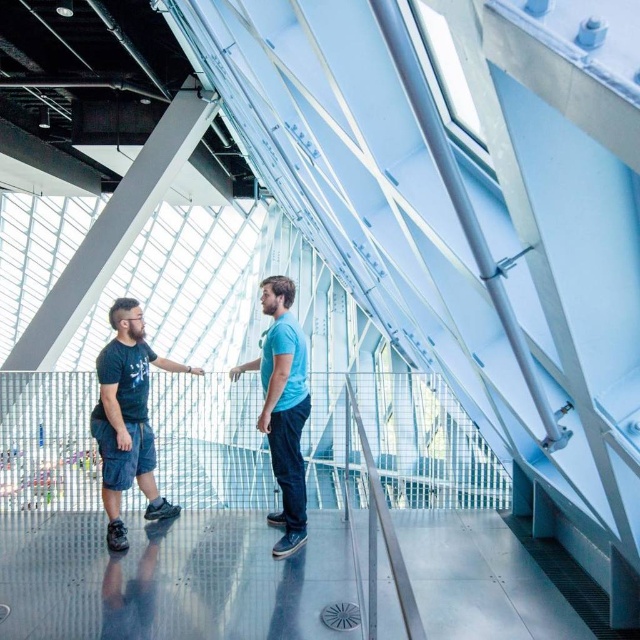
Can you confirm if dark gray cotton shorts at left is positioned to the right of blue cotton t-shirt at center?

In fact, dark gray cotton shorts at left is to the left of blue cotton t-shirt at center.

Between dark gray cotton shorts at left and blue cotton t-shirt at center, which one appears on the left side from the viewer's perspective?

From the viewer's perspective, dark gray cotton shorts at left appears more on the left side.

Which is behind, point (138, 400) or point (282, 372)?

Point (138, 400)

Where is `dark gray cotton shorts at left`? The image size is (640, 640). dark gray cotton shorts at left is located at coordinates (128, 419).